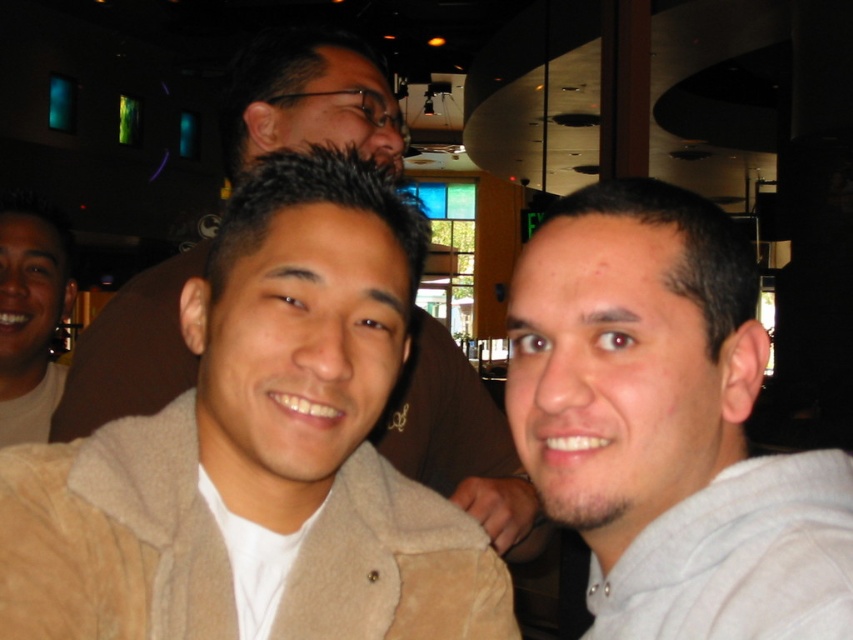
Question: Which point is closer to the camera?

Choices:
 (A) (61, 429)
 (B) (567, 278)
 (C) (28, 260)

Answer: (B)

Question: Observing the image, what is the correct spatial positioning of gray hoodie at right in reference to beige suede jacket at center?

Choices:
 (A) above
 (B) below

Answer: (B)

Question: Which point is closer to the camera taking this photo?

Choices:
 (A) (167, 355)
 (B) (648, 372)

Answer: (B)

Question: Can you confirm if gray hoodie at right is wider than beige suede jacket at center?

Choices:
 (A) no
 (B) yes

Answer: (A)

Question: Which point is farther to the camera?

Choices:
 (A) beige suede jacket at center
 (B) light brown t-shirt at left

Answer: (B)

Question: Is gray hoodie at right to the left of light brown t-shirt at left from the viewer's perspective?

Choices:
 (A) no
 (B) yes

Answer: (A)